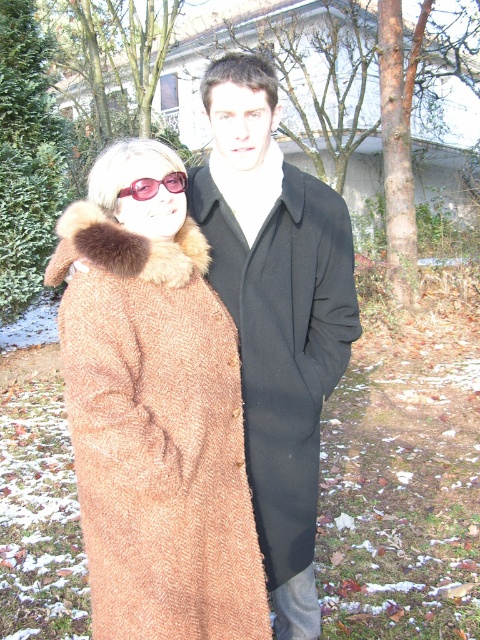
You are a photographer trying to capture a photo of the black wool coat at center and the translucent pink goggles at upper left. Since you want both subjects in focus, you need to know their positions relative to each other. Which object is positioned to the right of the other?

The black wool coat at center is to the right of the translucent pink goggles at upper left.

You are a photographer trying to capture a closeup of the brown wool coat at center. The camera you are using has a focal length of 50mm and an aperture of f2.8. If you want to ensure the entire coat is in focus, what should your minimum focusing distance be?

The minimum focusing distance required to capture the entire brown wool coat at center in focus with a 50mm lens at f2.8 would depend on the coat size and distance from the camera. However, since the coat is positioned at point (276, 314) in the frame, you should adjust your distance to ensure depth of field covers that area.

You are a photographer trying to capture a photo of both the brown wool coat at center and the black wool coat at center. Since they are positioned close to each other, you need to adjust your camera angle to ensure both coats are fully visible. Based on their positions, which direction should you move your camera to include both coats in the frame?

Since the brown wool coat at center is to the left of the black wool coat at center, you should move your camera to the right to include both coats in the frame.